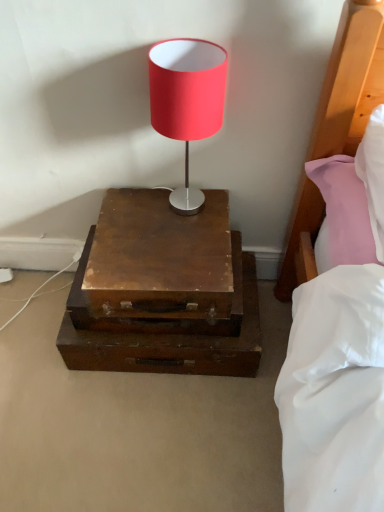
What do you see at coordinates (162, 291) in the screenshot? I see `wooden nightstand at center` at bounding box center [162, 291].

Find the location of a particular element. The image size is (384, 512). wooden drawer at center is located at coordinates (157, 304).

At what (x,y) coordinates should I click in order to perform the action: click on wooden nightstand at center. Please return your answer as a coordinate pair (x, y). Image resolution: width=384 pixels, height=512 pixels. Looking at the image, I should click on (162, 291).

Who is shorter, wooden drawer at center or wooden nightstand at center?

wooden drawer at center is shorter.

From a real-world perspective, which object rests below the other?

wooden nightstand at center.

From the image's perspective, which object appears higher, wooden drawer at center or wooden nightstand at center?

wooden drawer at center.

Considering the sizes of objects wooden drawer at center and wooden nightstand at center in the image provided, who is wider, wooden drawer at center or wooden nightstand at center?

wooden nightstand at center.

Measure the distance from matte red lampshade at center to wooden nightstand at center.

matte red lampshade at center and wooden nightstand at center are 11.25 inches apart.

How many degrees apart are the facing directions of matte red lampshade at center and wooden nightstand at center?

1.13 degrees.

From a real-world perspective, which is physically above, matte red lampshade at center or wooden nightstand at center?

matte red lampshade at center.

Which point is more forward, (216, 124) or (115, 196)?

The point (216, 124) is closer to the camera.

Is wooden nightstand at center oriented towards matte red lampshade at center?

No.

Is point (213, 278) farther from camera compared to point (165, 135)?

That is True.

Between wooden nightstand at center and matte red lampshade at center, which one has more height?

Standing taller between the two is matte red lampshade at center.

From a real-world perspective, is wooden nightstand at center above or below matte red lampshade at center?

wooden nightstand at center is situated lower than matte red lampshade at center in the real world.

Considering the sizes of objects wooden drawer at center and matte red lampshade at center in the image provided, who is smaller, wooden drawer at center or matte red lampshade at center?

With smaller size is matte red lampshade at center.

Visually, is wooden drawer at center positioned to the left or to the right of matte red lampshade at center?

wooden drawer at center is positioned on matte red lampshade at center's left side.

Is wooden drawer at center in front of matte red lampshade at center?

No.

Where is `drawer to the left of matte red lampshade at center`? This screenshot has width=384, height=512. drawer to the left of matte red lampshade at center is located at coordinates (157, 304).

Considering the points (184, 76) and (239, 236), which point is in front, point (184, 76) or point (239, 236)?

The point (184, 76) is in front.

Considering the sizes of objects matte red lampshade at center and wooden drawer at center in the image provided, who is shorter, matte red lampshade at center or wooden drawer at center?

wooden drawer at center.

Does matte red lampshade at center come in front of wooden drawer at center?

That is True.

Can you tell me how much wooden nightstand at center and wooden drawer at center differ in facing direction?

wooden nightstand at center and wooden drawer at center are facing 0.773 degrees away from each other.

Which of these two, wooden nightstand at center or wooden drawer at center, stands taller?

wooden nightstand at center is taller.

Does wooden nightstand at center have a lesser width compared to wooden drawer at center?

No.

In order to click on nightstand on the right of wooden drawer at center in this screenshot , I will do `click(162, 291)`.

Locate an element on the screen. This screenshot has width=384, height=512. lamp located above the wooden nightstand at center (from the image's perspective) is located at coordinates (187, 101).

Considering their positions, is wooden drawer at center positioned closer to matte red lampshade at center than wooden nightstand at center?

Among the two, wooden nightstand at center is located nearer to matte red lampshade at center.

When comparing their distances from wooden nightstand at center, does matte red lampshade at center or wooden drawer at center seem further?

matte red lampshade at center is further to wooden nightstand at center.

When comparing their distances from wooden nightstand at center, does wooden drawer at center or matte red lampshade at center seem further?

Based on the image, matte red lampshade at center appears to be further to wooden nightstand at center.

From the image, which object appears to be nearer to matte red lampshade at center, wooden nightstand at center or wooden drawer at center?

wooden nightstand at center is positioned closer to the anchor matte red lampshade at center.

Looking at the image, which one is located further to wooden drawer at center, wooden nightstand at center or matte red lampshade at center?

matte red lampshade at center is further to wooden drawer at center.

In the scene shown: Considering their positions, is matte red lampshade at center positioned closer to wooden drawer at center than wooden nightstand at center?

wooden nightstand at center lies closer to wooden drawer at center than the other object.

At what (x,y) coordinates should I click in order to perform the action: click on drawer that lies between matte red lampshade at center and wooden nightstand at center from top to bottom. Please return your answer as a coordinate pair (x, y). The width and height of the screenshot is (384, 512). Looking at the image, I should click on (157, 304).